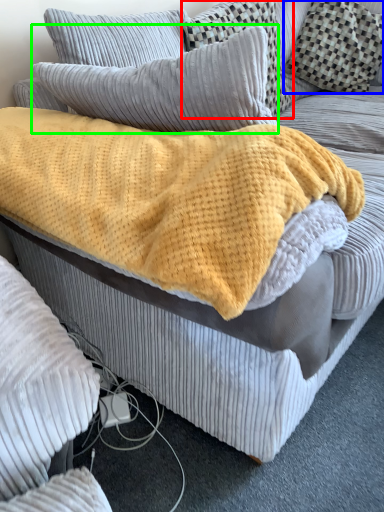
Question: Considering the real-world distances, which object is farthest from pillow (highlighted by a red box)? pillow (highlighted by a blue box) or pillow (highlighted by a green box)?

Choices:
 (A) pillow
 (B) pillow

Answer: (B)